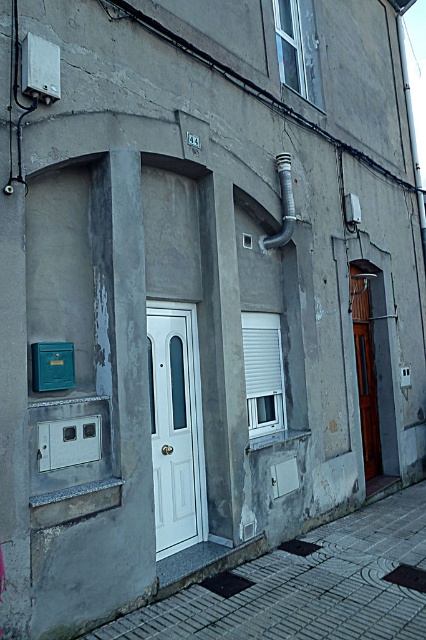
Is metallic gray mailbox at lower left further to camera compared to green plastic mailbox at lower left?

No, it is not.

Does point (91, 456) lie behind point (51, 372)?

Yes, it is.

The image size is (426, 640). Find the location of `metallic gray mailbox at lower left`. metallic gray mailbox at lower left is located at coordinates (68, 442).

Between brown wooden door at right and green plastic mailbox at lower left, which one appears on the right side from the viewer's perspective?

brown wooden door at right is more to the right.

Which is behind, point (356, 282) or point (37, 352)?

Positioned behind is point (356, 282).

I want to click on brown wooden door at right, so click(x=365, y=371).

From the picture: Is brick pavement at center thinner than white glossy door at center?

Incorrect, brick pavement at center's width is not less than white glossy door at center's.

Who is shorter, brick pavement at center or white glossy door at center?

brick pavement at center

The height and width of the screenshot is (640, 426). What are the coordinates of `brick pavement at center` in the screenshot? It's located at (307, 586).